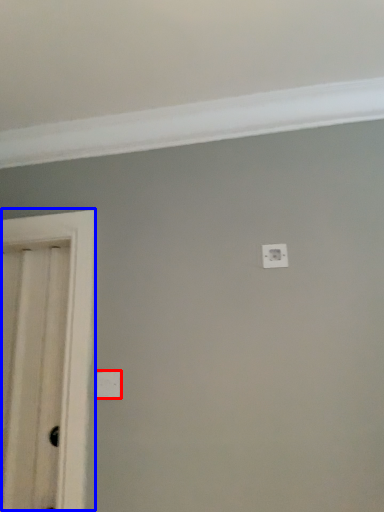
Question: Which object is closer to the camera taking this photo, light switch (highlighted by a red box) or door (highlighted by a blue box)?

Choices:
 (A) light switch
 (B) door

Answer: (B)